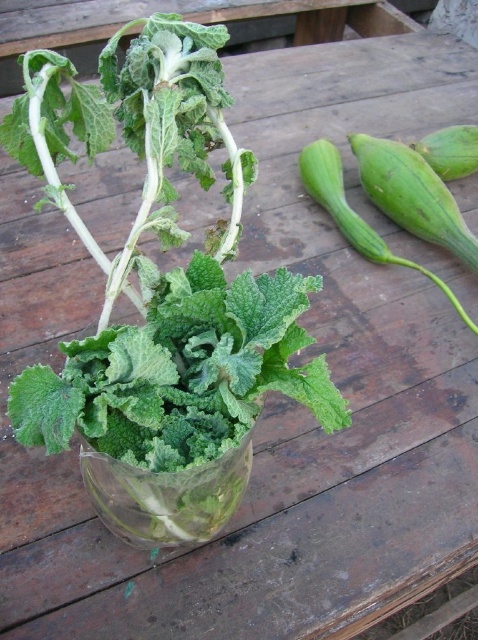
Can you confirm if transparent glass vase at center is taller than green smooth squash at right?

In fact, transparent glass vase at center may be shorter than green smooth squash at right.

Can you confirm if transparent glass vase at center is bigger than green smooth squash at right?

Actually, transparent glass vase at center might be smaller than green smooth squash at right.

Who is more distant from viewer, (108, 472) or (315, 157)?

Point (315, 157)

Identify the location of transparent glass vase at center. This screenshot has width=478, height=640. (165, 497).